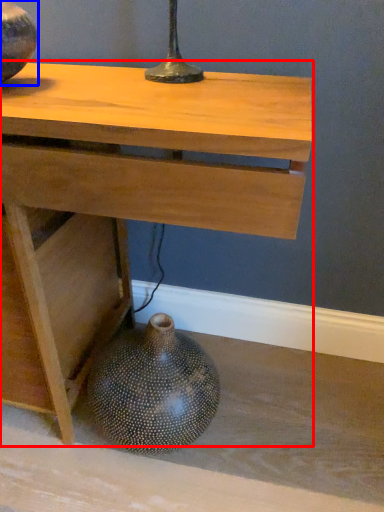
Question: Among these objects, which one is farthest to the camera, table (highlighted by a red box) or vase (highlighted by a blue box)?

Choices:
 (A) table
 (B) vase

Answer: (B)